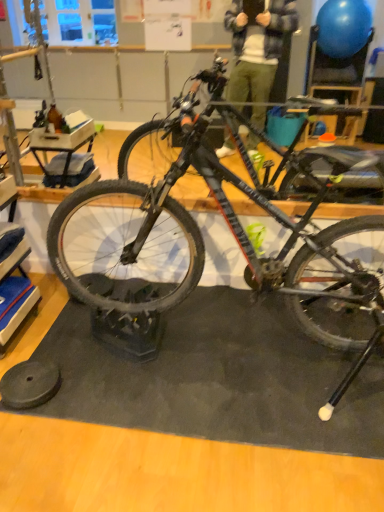
Find the location of `free space behind black rubber wheel at lower left`. free space behind black rubber wheel at lower left is located at coordinates (66, 342).